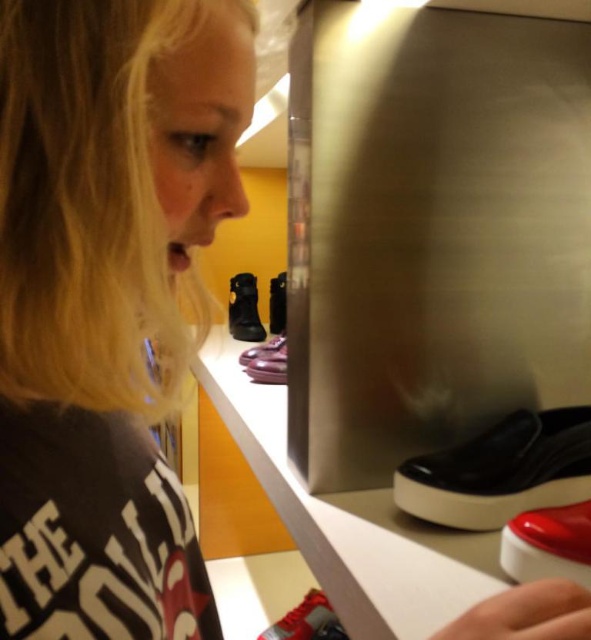
You are a customer in a store and want to buy a shiny red shoe. The store uses a coordinate system where the bottom left corner is the origin. The display case has a coordinate grid with x and y values ranging from 0 to 1. You see a point labeled at coordinates point (548, 545). Can you determine if the shiny red shoe at lower right is located at that point?

The point (548, 545) indicates shiny red shoe at lower right, so yes, the shiny red shoe at lower right is located at that point.

You are a customer in a store and you see the black matte shoe at lower right and the shiny red shoe at lower right. Which shoe is positioned higher on the display case shelf?

The black matte shoe at lower right is located above the shiny red shoe at lower right, so it is positioned higher on the display case shelf.